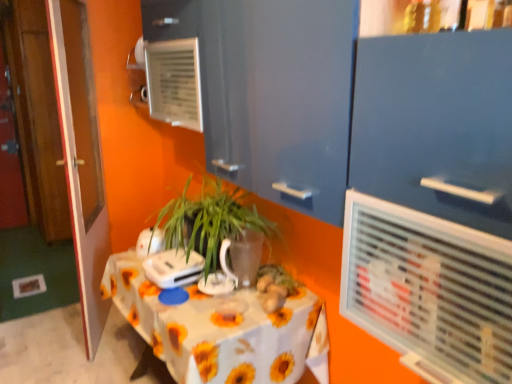
I want to click on vacant area that is in front of wooden door at left, so click(x=75, y=357).